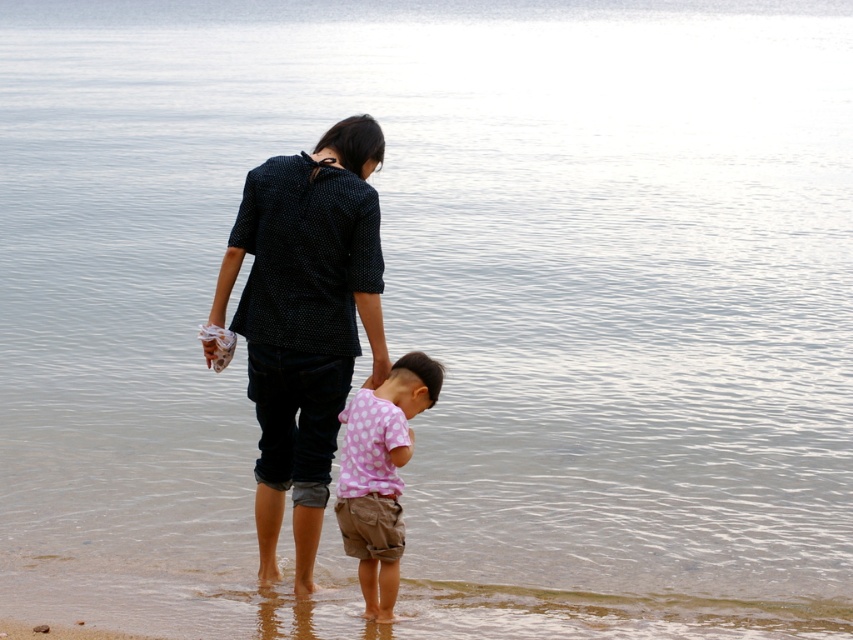
Is point (263, 524) positioned after point (335, 492)?

Yes, it is.

Does black dotted shirt at center have a smaller size compared to pink dotted shirt at lower center?

Incorrect, black dotted shirt at center is not smaller in size than pink dotted shirt at lower center.

Is point (332, 428) farther from camera compared to point (358, 460)?

Yes, it is behind point (358, 460).

Image resolution: width=853 pixels, height=640 pixels. Identify the location of black dotted shirt at center. (305, 320).